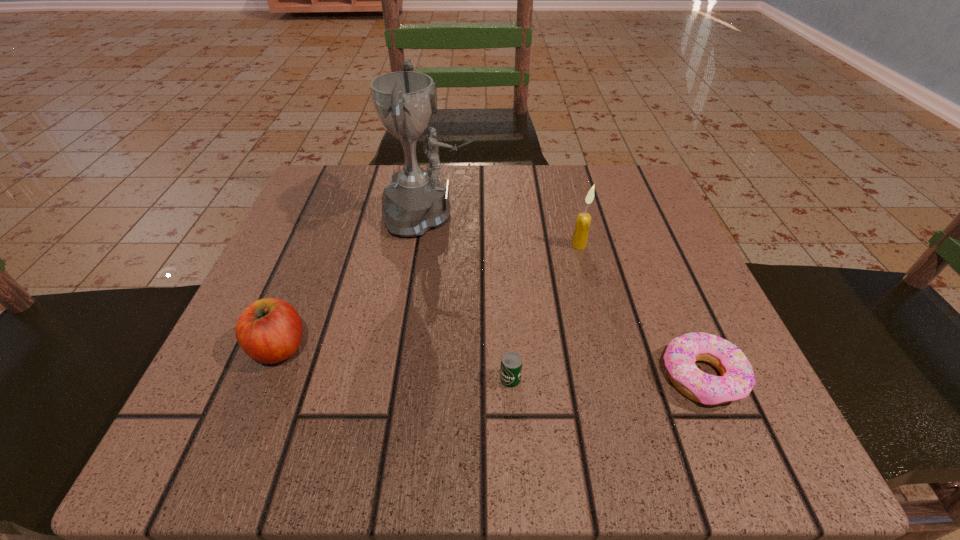
Find the location of a particular element. This screenshot has width=960, height=540. the tallest object is located at coordinates (416, 201).

This screenshot has height=540, width=960. I want to click on the fourth object from right to left, so click(416, 201).

At what (x,y) coordinates should I click in order to perform the action: click on the second object from right to left. Please return your answer as a coordinate pair (x, y). The width and height of the screenshot is (960, 540). Looking at the image, I should click on click(x=583, y=221).

Find the location of a particular element. The image size is (960, 540). the fourth shortest object is located at coordinates (583, 221).

Where is `apple`? This screenshot has height=540, width=960. apple is located at coordinates (270, 330).

Locate an element on the screen. The height and width of the screenshot is (540, 960). the leftmost object is located at coordinates (270, 330).

Identify the location of beer can. The height and width of the screenshot is (540, 960). (511, 364).

This screenshot has width=960, height=540. Identify the location of the rightmost object. (737, 379).

Find the location of a particular element. This screenshot has width=960, height=540. vacant space located on the side with emblem of the tallest object is located at coordinates (629, 215).

Locate an element on the screen. free point located 0.130m on the right of the fourth object from left to right is located at coordinates (656, 245).